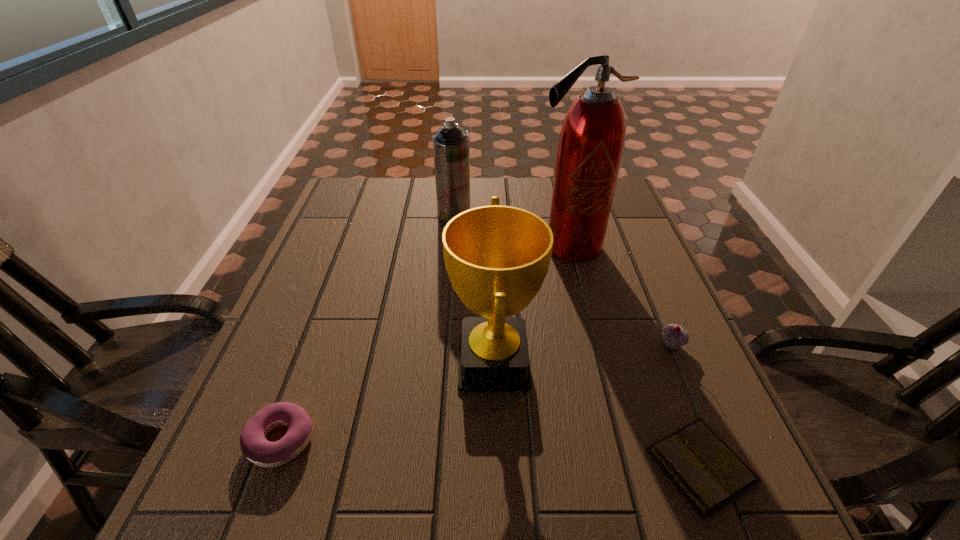
Where is `free space that is in between the tallest object and the fourth tallest object`? The height and width of the screenshot is (540, 960). free space that is in between the tallest object and the fourth tallest object is located at coordinates (620, 295).

Identify the location of free space that is in between the award and the shortest object. (597, 414).

Where is `free point between the third shortest object and the diary`? The height and width of the screenshot is (540, 960). free point between the third shortest object and the diary is located at coordinates (686, 405).

The height and width of the screenshot is (540, 960). In order to click on empty location between the farthest object and the shortest object in this screenshot , I will do `click(578, 340)`.

Find the location of a particular element. The width and height of the screenshot is (960, 540). empty space between the shortest object and the tallest object is located at coordinates (636, 356).

Select which object appears as the second closest to the fourth tallest object. Please provide its 2D coordinates. Your answer should be formatted as a tuple, i.e. [(x, y)], where the tuple contains the x and y coordinates of a point satisfying the conditions above.

[(592, 138)]

At what (x,y) coordinates should I click in order to perform the action: click on object that stands as the closest to the fourth tallest object. Please return your answer as a coordinate pair (x, y). The width and height of the screenshot is (960, 540). Looking at the image, I should click on (705, 469).

Locate an element on the screen. The width and height of the screenshot is (960, 540). vacant space that satisfies the following two spatial constraints: 1. on the back side of the tallest object; 2. on the right side of the fifth tallest object is located at coordinates (351, 246).